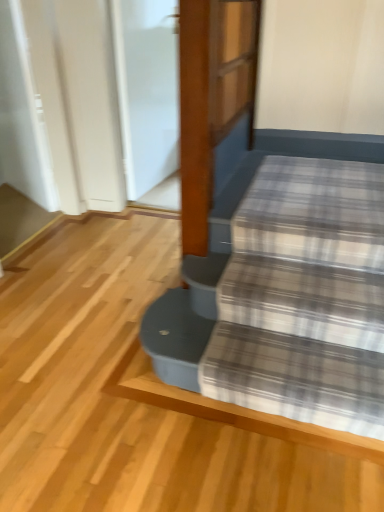
Where is `plaid fabric at lower right`? plaid fabric at lower right is located at coordinates (291, 301).

What is the approximate width of plaid fabric at lower right?

The width of plaid fabric at lower right is 18.20 inches.

Describe the element at coordinates (291, 301) in the screenshot. I see `plaid fabric at lower right` at that location.

Where is `plaid fabric at lower right`? plaid fabric at lower right is located at coordinates (291, 301).